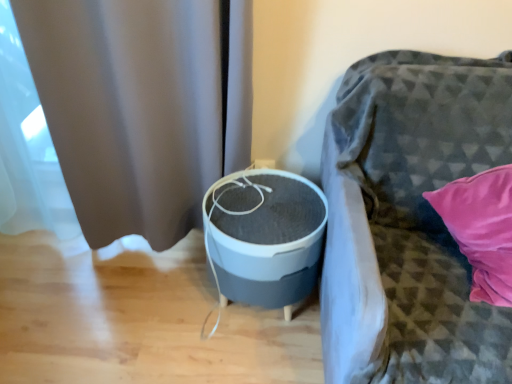
Question: Is gray matte/soft fabric round table at center oriented towards gray matte curtain at left?

Choices:
 (A) yes
 (B) no

Answer: (B)

Question: From a real-world perspective, is gray matte/soft fabric round table at center on gray matte curtain at left?

Choices:
 (A) yes
 (B) no

Answer: (B)

Question: Considering the relative sizes of gray matte/soft fabric round table at center and gray matte curtain at left in the image provided, is gray matte/soft fabric round table at center thinner than gray matte curtain at left?

Choices:
 (A) no
 (B) yes

Answer: (A)

Question: Is gray matte/soft fabric round table at center taller than gray matte curtain at left?

Choices:
 (A) no
 (B) yes

Answer: (A)

Question: From the image's perspective, is gray matte/soft fabric round table at center on gray matte curtain at left?

Choices:
 (A) no
 (B) yes

Answer: (A)

Question: Is textured gray fabric couch at right in front of or behind gray matte/soft fabric round table at center in the image?

Choices:
 (A) behind
 (B) front

Answer: (B)

Question: Is textured gray fabric couch at right wider or thinner than gray matte/soft fabric round table at center?

Choices:
 (A) wide
 (B) thin

Answer: (A)

Question: Does point pyautogui.click(x=496, y=350) appear closer or farther from the camera than point pyautogui.click(x=219, y=251)?

Choices:
 (A) closer
 (B) farther

Answer: (A)

Question: Would you say textured gray fabric couch at right is inside or outside gray matte/soft fabric round table at center?

Choices:
 (A) inside
 (B) outside

Answer: (B)

Question: Does point (186, 112) appear closer or farther from the camera than point (371, 57)?

Choices:
 (A) farther
 (B) closer

Answer: (A)

Question: From a real-world perspective, is gray matte curtain at left above or below textured gray fabric couch at right?

Choices:
 (A) below
 (B) above

Answer: (B)

Question: In the image, is gray matte curtain at left on the left side or the right side of textured gray fabric couch at right?

Choices:
 (A) right
 (B) left

Answer: (B)

Question: Considering the positions of gray matte curtain at left and textured gray fabric couch at right in the image, is gray matte curtain at left wider or thinner than textured gray fabric couch at right?

Choices:
 (A) wide
 (B) thin

Answer: (B)

Question: Considering the positions of gray matte curtain at left and gray matte/soft fabric round table at center in the image, is gray matte curtain at left wider or thinner than gray matte/soft fabric round table at center?

Choices:
 (A) wide
 (B) thin

Answer: (B)

Question: In terms of height, does gray matte curtain at left look taller or shorter compared to gray matte/soft fabric round table at center?

Choices:
 (A) short
 (B) tall

Answer: (B)